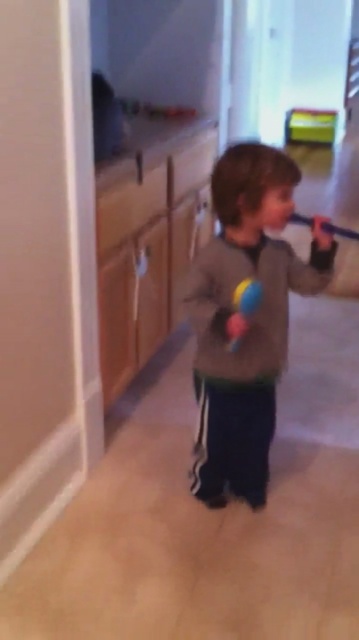
Question: Can you confirm if gray fleece sweater at center is bigger than rubber ball at center?

Choices:
 (A) no
 (B) yes

Answer: (B)

Question: Which point is closer to the camera?

Choices:
 (A) rubber ball at center
 (B) gray fleece sweater at center

Answer: (A)

Question: Is gray fleece sweater at center further to camera compared to rubber ball at center?

Choices:
 (A) no
 (B) yes

Answer: (B)

Question: From the image, what is the correct spatial relationship of gray fleece sweater at center in relation to rubber ball at center?

Choices:
 (A) left
 (B) right

Answer: (B)

Question: Among these objects, which one is farthest from the camera?

Choices:
 (A) gray fleece sweater at center
 (B) rubber ball at center

Answer: (A)